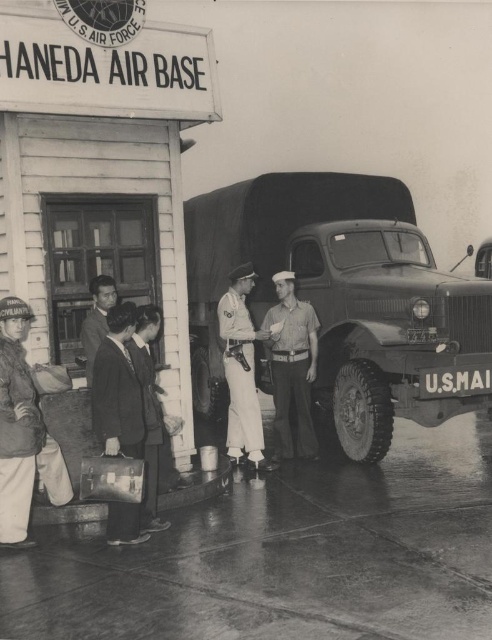
Question: Estimate the real-world distances between objects in this image. Which object is closer to the dark suit at center?

Choices:
 (A) white uniform at center
 (B) light brown uniform at center
 (C) matte green truck at center

Answer: (A)

Question: Does matte green truck at center appear over light brown uniform at center?

Choices:
 (A) no
 (B) yes

Answer: (B)

Question: Can you confirm if light brown uniform at center is positioned to the right of white uniform at center?

Choices:
 (A) no
 (B) yes

Answer: (B)

Question: Which object is closer to the camera taking this photo?

Choices:
 (A) dark suit at center
 (B) white uniform at center
 (C) smooth leather briefcase at center

Answer: (C)

Question: Is matte green truck at center wider than dark suit at center?

Choices:
 (A) no
 (B) yes

Answer: (B)

Question: Which object appears farthest from the camera in this image?

Choices:
 (A) light brown uniform at center
 (B) smooth leather briefcase at center
 (C) dark suit at center

Answer: (A)